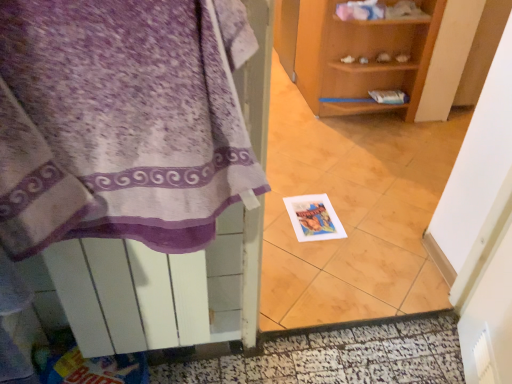
Identify the location of vacant area on top of white glossy door at lower center (from a real-world perspective). (332, 361).